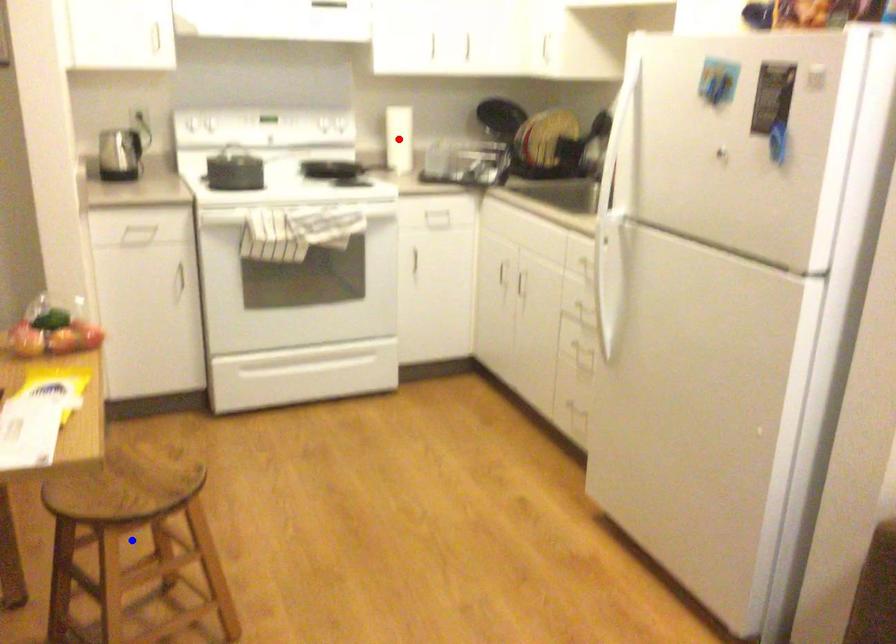
Question: Two points are marked on the image. Which point is closer to the camera?

Choices:
 (A) Blue point is closer.
 (B) Red point is closer.

Answer: (A)